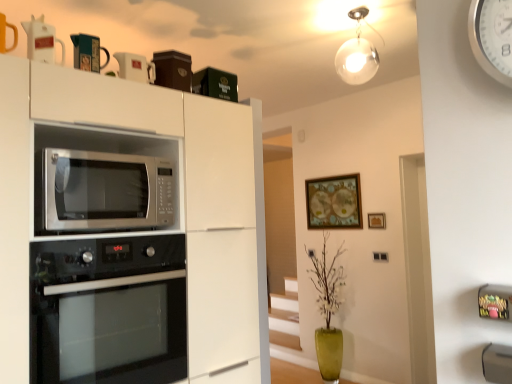
Where is `empty space that is ontop of black glass oven at lower left (from a real-world perspective)`? The image size is (512, 384). empty space that is ontop of black glass oven at lower left (from a real-world perspective) is located at coordinates (114, 235).